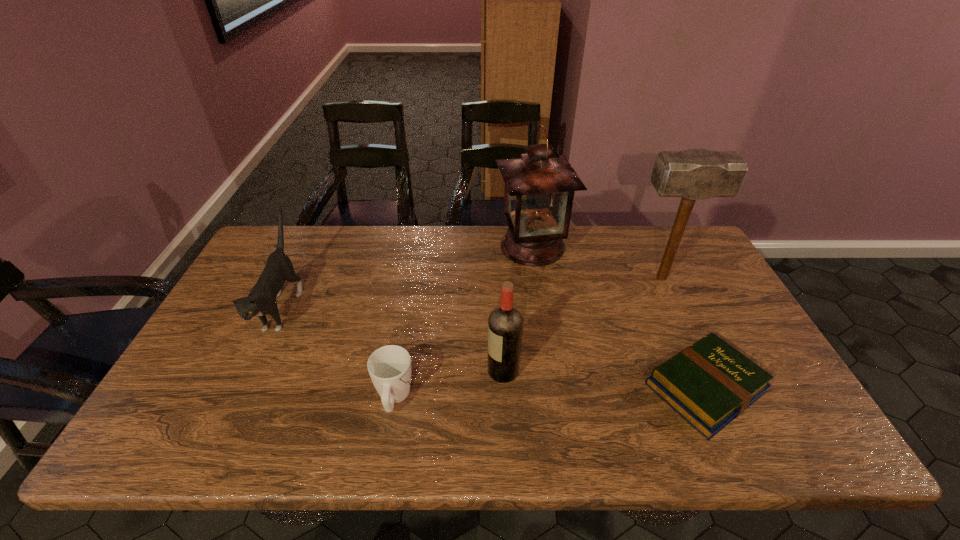
Identify the location of oil lamp. (539, 190).

This screenshot has height=540, width=960. I want to click on mallet, so click(x=692, y=174).

Locate an element on the screen. Image resolution: width=960 pixels, height=540 pixels. liquor is located at coordinates [x=505, y=323].

Where is `the third shortest object`? the third shortest object is located at coordinates (261, 300).

The width and height of the screenshot is (960, 540). Find the location of `cat`. cat is located at coordinates (261, 300).

This screenshot has width=960, height=540. Find the location of `mug`. mug is located at coordinates (389, 367).

The height and width of the screenshot is (540, 960). Find the location of `the fifth object from right to left`. the fifth object from right to left is located at coordinates (389, 367).

Where is `book`? This screenshot has width=960, height=540. book is located at coordinates (710, 383).

Locate an element on the screen. The image size is (960, 540). free space located on the left of the oil lamp is located at coordinates (420, 246).

Locate an element on the screen. This screenshot has height=540, width=960. vacant region located on the striking face of the mallet is located at coordinates (535, 278).